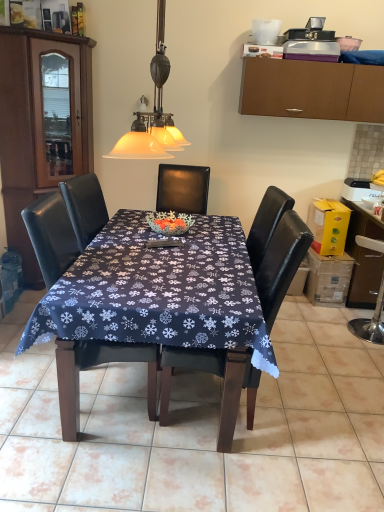
Where is `free location in front of black leather chair at center, which is the 1th chair from right to left`? This screenshot has height=512, width=384. free location in front of black leather chair at center, which is the 1th chair from right to left is located at coordinates (248, 485).